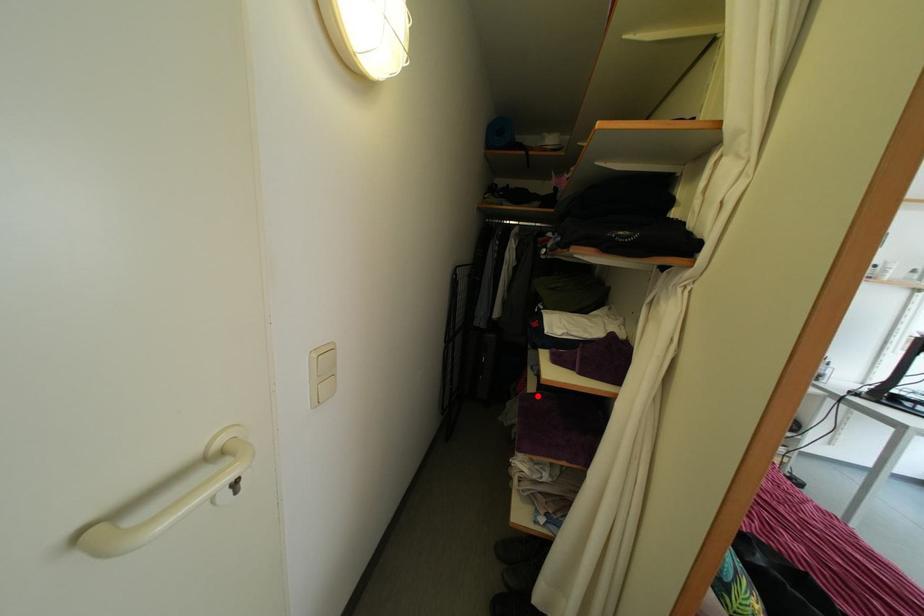
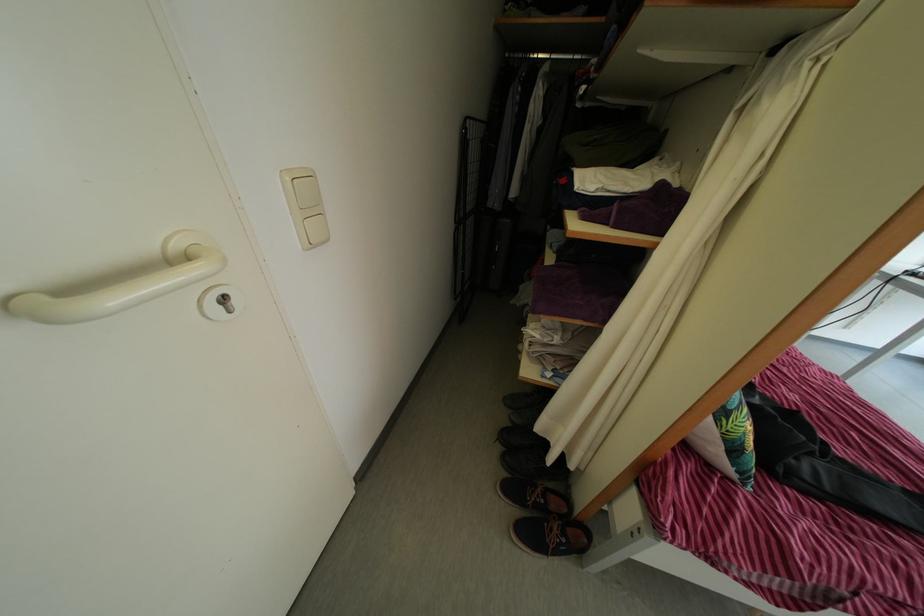
Question: A red point is marked in image1. In image2, is the corresponding 3D point closer to the camera or farther? Reply with the corresponding letter.

Choices:
 (A) The corresponding 3D point is closer.
 (B) The corresponding 3D point is farther.

Answer: (A)